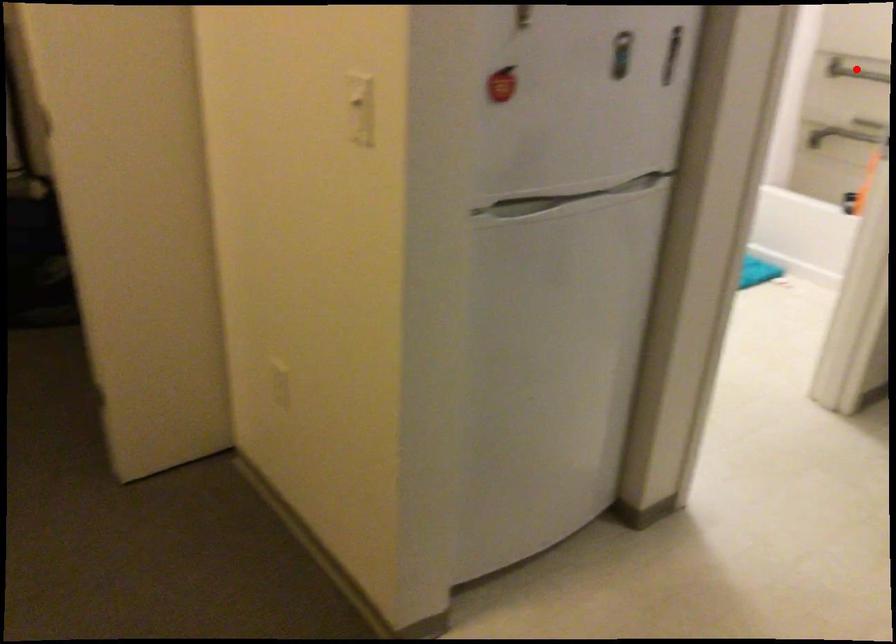
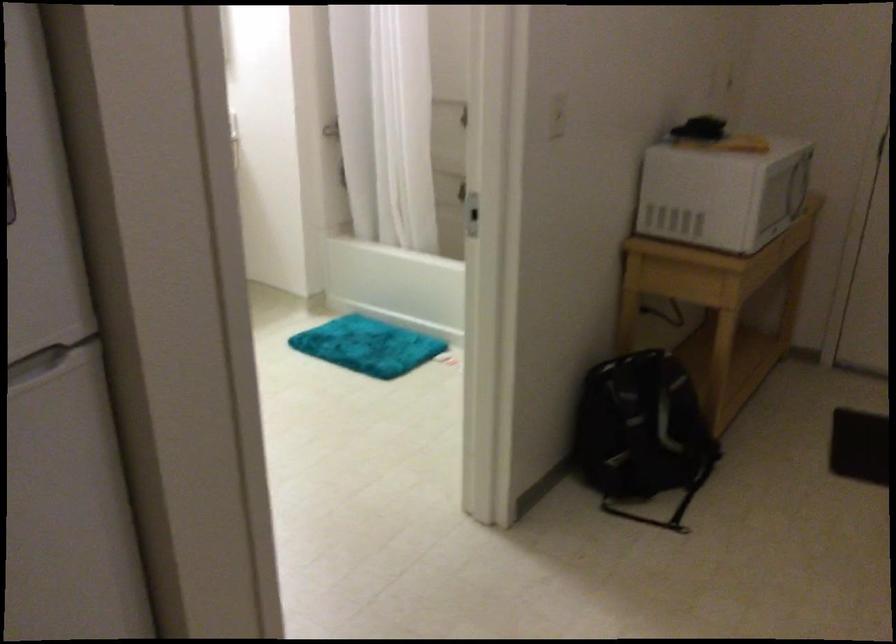
Question: I am providing you with two images of the same scene from different viewpoints. A red point is marked on the first image. Is the red point's position out of view in image 2?

Choices:
 (A) Yes
 (B) No

Answer: (A)